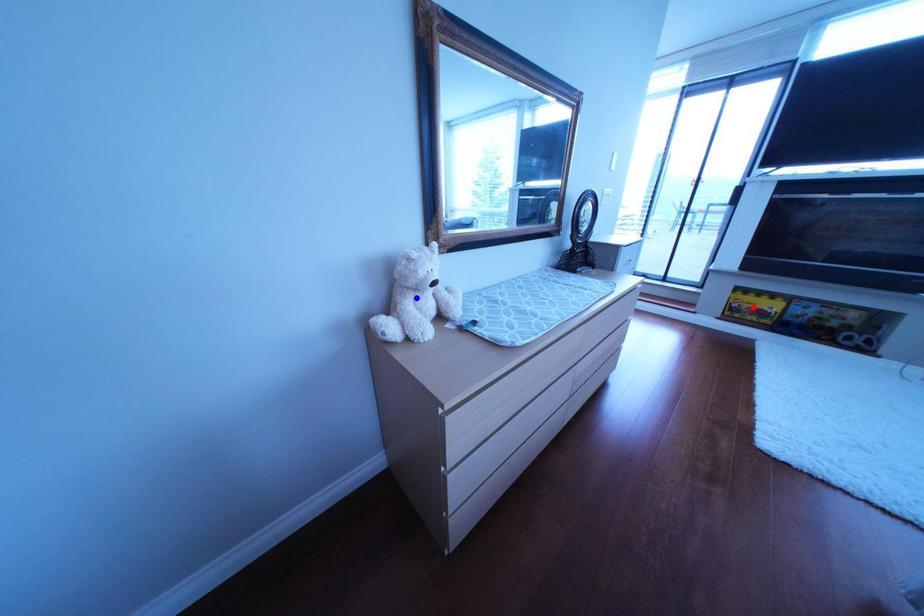
Question: In the image, two points are highlighted. Which point is nearer to the camera? Reply with the corresponding letter.

Choices:
 (A) blue point
 (B) red point

Answer: (A)